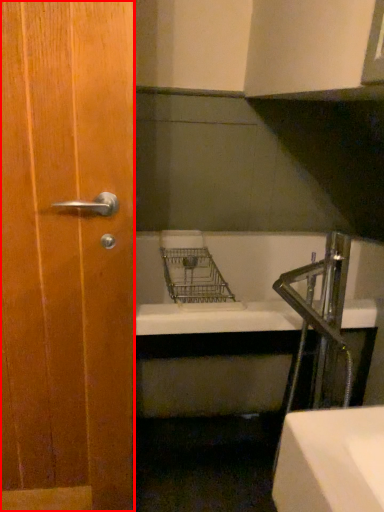
Question: From the image's perspective, what is the correct spatial relationship of door (annotated by the red box) in relation to faucet?

Choices:
 (A) above
 (B) below

Answer: (A)